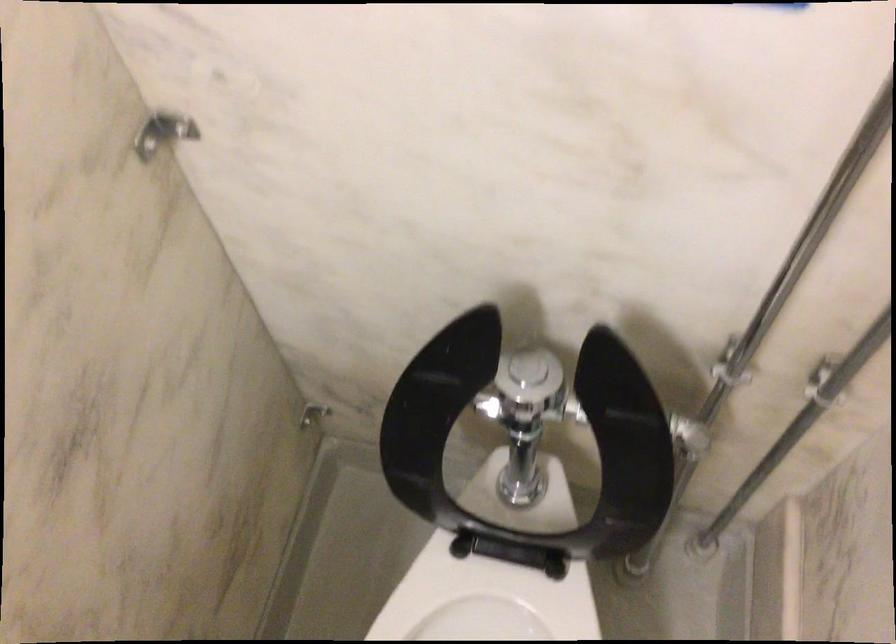
Identify the location of chrome flush button. The width and height of the screenshot is (896, 644). (528, 368).